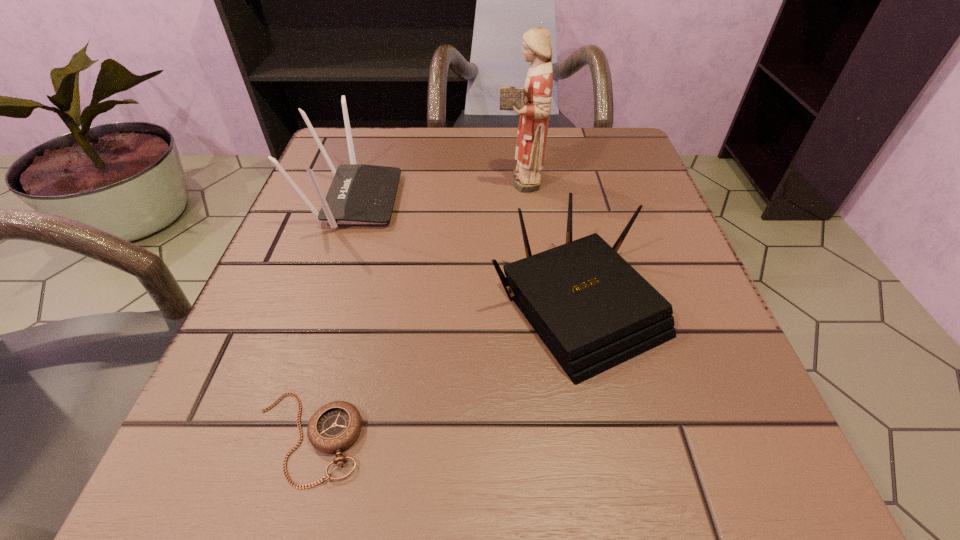
The image size is (960, 540). I want to click on blank area in the image that satisfies the following two spatial constraints: 1. on the front-facing side of the tallest object; 2. on the left side of the nearer router, so click(532, 305).

Find the location of a particular element. The height and width of the screenshot is (540, 960). vacant space that satisfies the following two spatial constraints: 1. on the back side of the nearest object; 2. on the left side of the second shortest object is located at coordinates (345, 305).

Where is `free point that satisfies the following two spatial constraints: 1. on the front-facing side of the tallest object; 2. on the right side of the third farthest object`? Image resolution: width=960 pixels, height=540 pixels. free point that satisfies the following two spatial constraints: 1. on the front-facing side of the tallest object; 2. on the right side of the third farthest object is located at coordinates (532, 305).

Where is `free location that satisfies the following two spatial constraints: 1. on the front-facing side of the figurine; 2. on the back side of the third farthest object`? free location that satisfies the following two spatial constraints: 1. on the front-facing side of the figurine; 2. on the back side of the third farthest object is located at coordinates (532, 305).

Identify the location of vacant region that satisfies the following two spatial constraints: 1. on the front-facing side of the right router; 2. on the right side of the tallest object. Image resolution: width=960 pixels, height=540 pixels. (532, 305).

At what (x,y) coordinates should I click in order to perform the action: click on free region that satisfies the following two spatial constraints: 1. on the front-facing side of the left router; 2. on the right side of the nearest object. Please return your answer as a coordinate pair (x, y). The image size is (960, 540). Looking at the image, I should click on (273, 437).